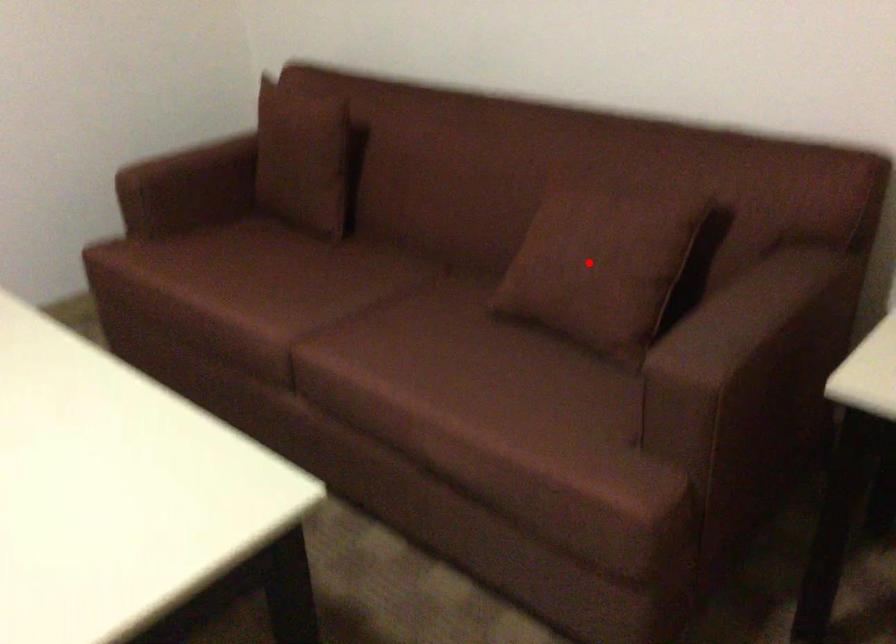
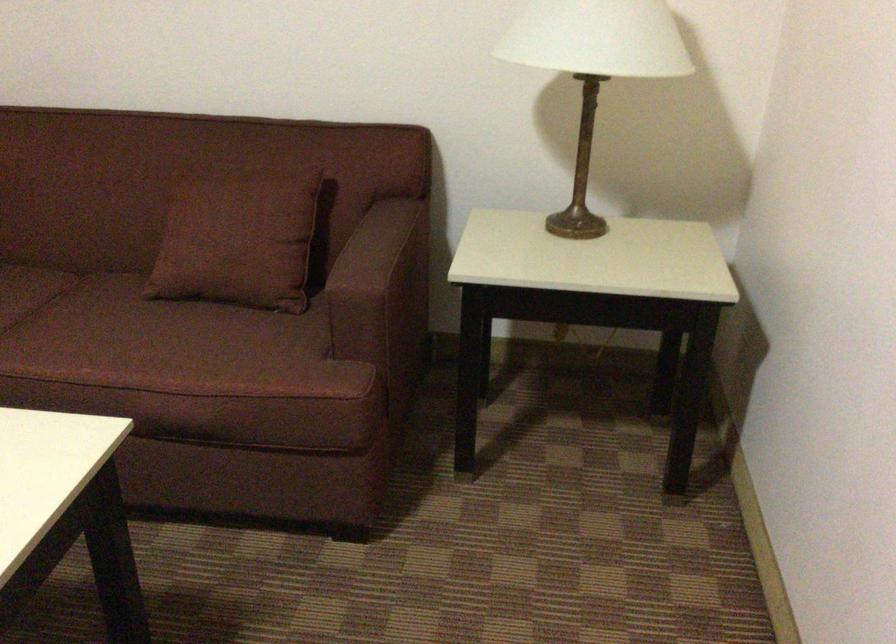
Question: I am providing you with two images of the same scene from different viewpoints. A red point is shown in image1. For the corresponding object point in image2, is it positioned nearer or farther from the camera?

Choices:
 (A) Nearer
 (B) Farther

Answer: (B)